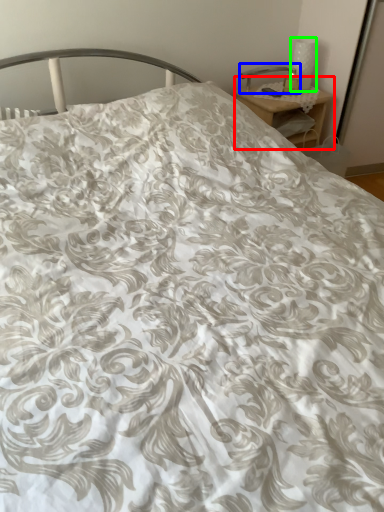
Question: Estimate the real-world distances between objects in this image. Which object is closer to nightstand (highlighted by a red box), table lamp (highlighted by a blue box) or table lamp (highlighted by a green box)?

Choices:
 (A) table lamp
 (B) table lamp

Answer: (A)